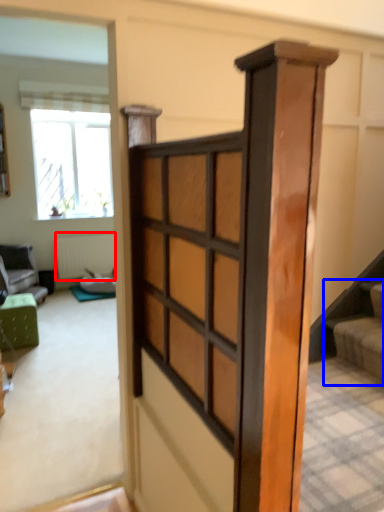
Question: Among these objects, which one is farthest to the camera, radiator (highlighted by a red box) or stairs (highlighted by a blue box)?

Choices:
 (A) radiator
 (B) stairs

Answer: (A)